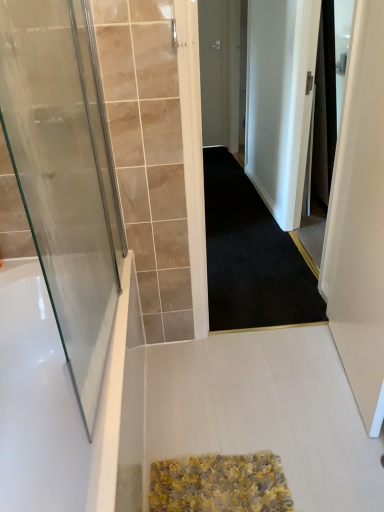
Question: Is white glossy bathtub at left taller or shorter than matte gray door at center, the 2th door positioned from the front?

Choices:
 (A) short
 (B) tall

Answer: (A)

Question: From the image's perspective, is white glossy bathtub at left above or below matte gray door at center, the 1th door viewed from the top?

Choices:
 (A) below
 (B) above

Answer: (A)

Question: Based on their relative distances, which object is farther from the black carpet at center?

Choices:
 (A) matte gray door at center, the 2th door positioned from the bottom
 (B) transparent glass door at left, which is counted as the 1th door, starting from the bottom
 (C) white glossy bathtub at left
 (D) white matte screen door at right
 (E) black fabric shower curtain at right

Answer: (A)

Question: Which object is the farthest from the white glossy bathtub at left?

Choices:
 (A) transparent glass door at left, acting as the 2th door starting from the top
 (B) black fabric shower curtain at right
 (C) black carpet at center
 (D) white matte screen door at right
 (E) matte gray door at center, marked as the second door in a left-to-right arrangement

Answer: (E)